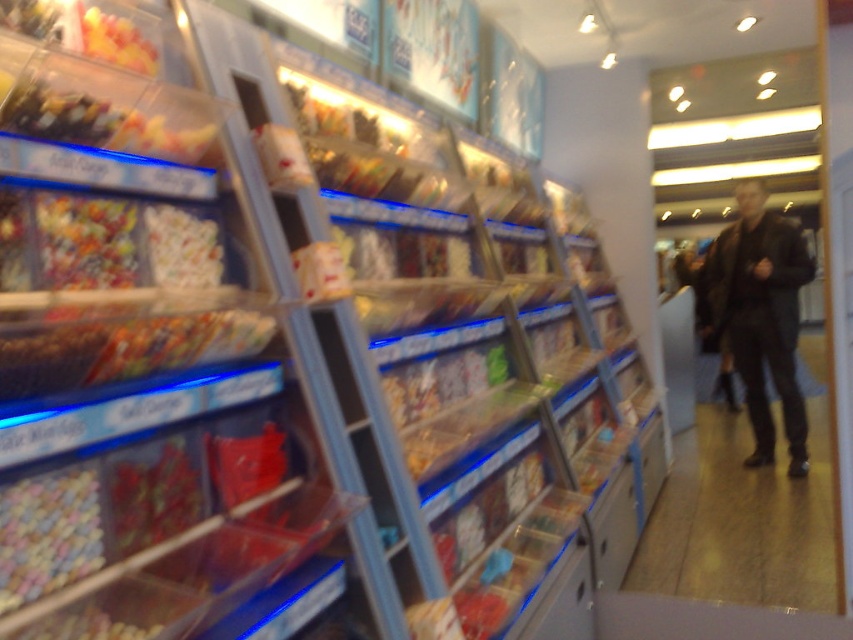
Can you confirm if black leather pants at lower right is bigger than pastel mosaic tiles at lower left?

Indeed, black leather pants at lower right has a larger size compared to pastel mosaic tiles at lower left.

You are a GUI agent. You are given a task and a screenshot of the screen. Output one action in this format:
    pyautogui.click(x=<x>, y=<y>)
    Task: Click on the black leather pants at lower right
    
    Given the screenshot: What is the action you would take?
    (741, 518)

Does dark brown leather jacket at right appear under pastel mosaic tiles at lower left?

No.

Who is shorter, dark brown leather jacket at right or pastel mosaic tiles at lower left?

pastel mosaic tiles at lower left is shorter.

The height and width of the screenshot is (640, 853). In order to click on dark brown leather jacket at right in this screenshot , I will do `click(761, 316)`.

In order to click on dark brown leather jacket at right in this screenshot , I will do `click(761, 316)`.

Is black leather pants at lower right wider than dark brown leather jacket at right?

Yes.

Is point (809, 380) behind point (735, 355)?

Yes, point (809, 380) is farther from viewer.

Where is `black leather pants at lower right`? Image resolution: width=853 pixels, height=640 pixels. black leather pants at lower right is located at coordinates (741, 518).

At what (x,y) coordinates should I click in order to perform the action: click on black leather pants at lower right. Please return your answer as a coordinate pair (x, y). Looking at the image, I should click on (741, 518).